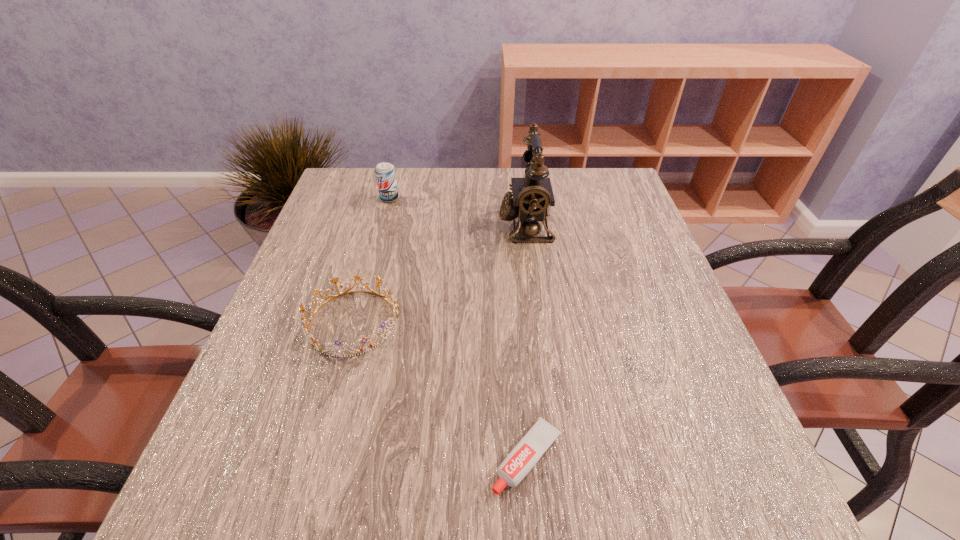
You are a GUI agent. You are given a task and a screenshot of the screen. Output one action in this format:
    pyautogui.click(x=<x>, y=<y>)
    Task: Click on the vacant space at the left edge of the desktop
    The width and height of the screenshot is (960, 540).
    Given the screenshot: What is the action you would take?
    pyautogui.click(x=236, y=448)

In the image, there is a desktop. At what (x,y) coordinates should I click in order to perform the action: click on vacant space at the right edge. Please return your answer as a coordinate pair (x, y). This screenshot has height=540, width=960. Looking at the image, I should click on (654, 301).

This screenshot has width=960, height=540. Find the location of `vacant space at the far left corner of the desktop`. vacant space at the far left corner of the desktop is located at coordinates (345, 172).

I want to click on vacant area at the near left corner, so click(x=212, y=506).

You are a GUI agent. You are given a task and a screenshot of the screen. Output one action in this format:
    pyautogui.click(x=<x>, y=<y>)
    Task: Click on the vacant space at the far right corner of the desktop
    
    Given the screenshot: What is the action you would take?
    pyautogui.click(x=589, y=188)

Where is `blank area at the near right corner`? The width and height of the screenshot is (960, 540). blank area at the near right corner is located at coordinates (710, 506).

Find the location of a particular element. This screenshot has width=960, height=540. free space between the beer can and the second nearest object is located at coordinates (372, 260).

Image resolution: width=960 pixels, height=540 pixels. I want to click on vacant area that lies between the third shortest object and the second shortest object, so click(x=372, y=260).

Where is `vacant point located between the telephone and the tiara`? Image resolution: width=960 pixels, height=540 pixels. vacant point located between the telephone and the tiara is located at coordinates (439, 273).

Find the location of a particular element. free space between the third tallest object and the tallest object is located at coordinates (439, 273).